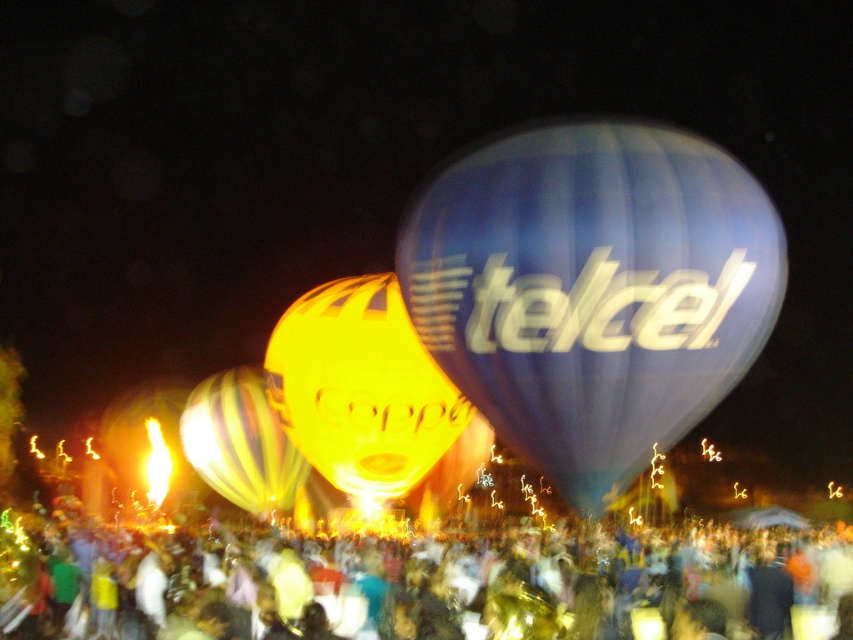
Question: Which point is farther from the camera taking this photo?

Choices:
 (A) (287, 476)
 (B) (772, 554)
 (C) (337, 362)
 (D) (427, 317)

Answer: (B)

Question: Estimate the real-world distances between objects in this image. Which object is closer to the blue glossy balloon at center?

Choices:
 (A) multicolored striped balloon at center
 (B) shiny yellow balloon at center
 (C) multicolored fabric crowd at lower center

Answer: (B)

Question: Does blue glossy balloon at center have a smaller size compared to multicolored fabric crowd at lower center?

Choices:
 (A) no
 (B) yes

Answer: (A)

Question: Observing the image, what is the correct spatial positioning of shiny yellow balloon at center in reference to multicolored striped balloon at center?

Choices:
 (A) above
 (B) below

Answer: (A)

Question: Based on their relative distances, which object is farther from the multicolored fabric crowd at lower center?

Choices:
 (A) multicolored striped balloon at center
 (B) shiny yellow balloon at center
 (C) blue glossy balloon at center

Answer: (C)

Question: Does multicolored fabric crowd at lower center appear over multicolored striped balloon at center?

Choices:
 (A) yes
 (B) no

Answer: (B)